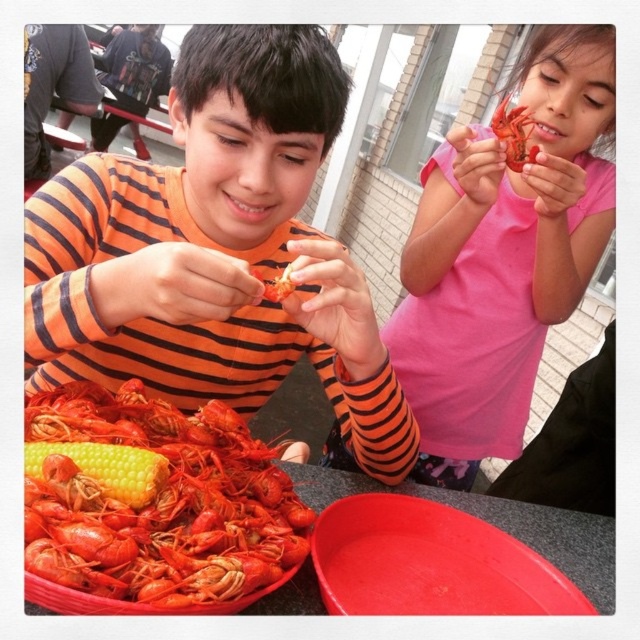
You are a photographer trying to capture a closeup of the shiny red lobster at lower left. However, the orange striped shirt at center is blocking your view. Can you adjust your position to get a clear shot without moving any objects?

The orange striped shirt at center is further to the viewer than the shiny red lobster at lower left, so you can move your position slightly to the side or angle your camera to avoid the obstruction caused by the shirt.